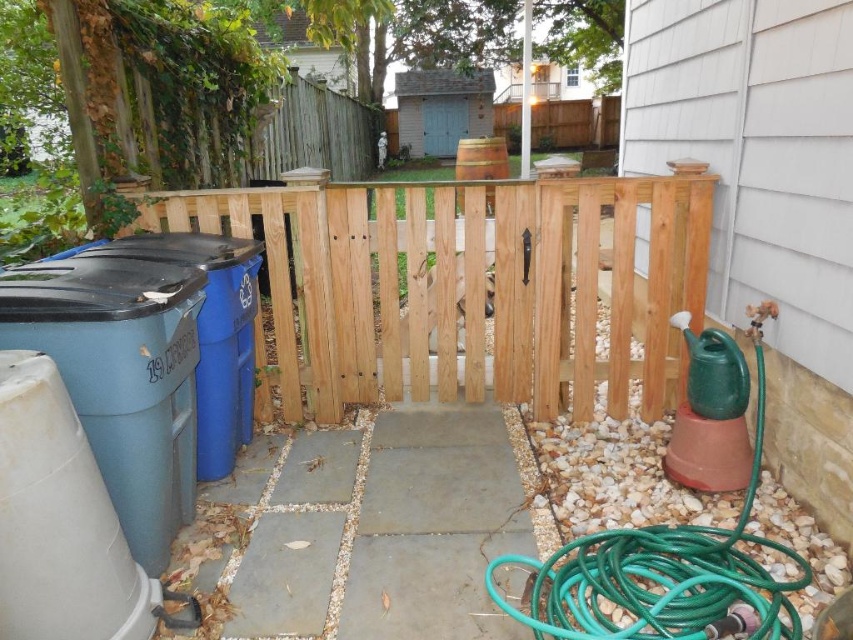
Between point (587, 582) and point (459, 156), which one is positioned behind?

The point (459, 156) is more distant.

Does green rubber garden hose at right have a lesser height compared to wooden barrel at center?

Indeed, green rubber garden hose at right has a lesser height compared to wooden barrel at center.

Is point (680, 593) positioned before point (476, 161)?

Yes.

This screenshot has height=640, width=853. I want to click on green rubber garden hose at right, so click(x=663, y=573).

Which of these two, natural wood gate at center or wooden barrel at center, stands taller?

wooden barrel at center

Is natural wood gate at center positioned in front of wooden barrel at center?

Yes, natural wood gate at center is in front of wooden barrel at center.

Who is more forward, (584, 212) or (486, 170)?

Point (584, 212)

The width and height of the screenshot is (853, 640). Find the location of `natural wood gate at center`. natural wood gate at center is located at coordinates (465, 285).

Is natural wood gate at center shorter than green rubber garden hose at right?

Incorrect, natural wood gate at center's height does not fall short of green rubber garden hose at right's.

Who is positioned more to the left, natural wood gate at center or green rubber garden hose at right?

natural wood gate at center

Is point (537, 336) more distant than point (762, 404)?

That is True.

This screenshot has height=640, width=853. In order to click on natural wood gate at center in this screenshot , I will do `click(465, 285)`.